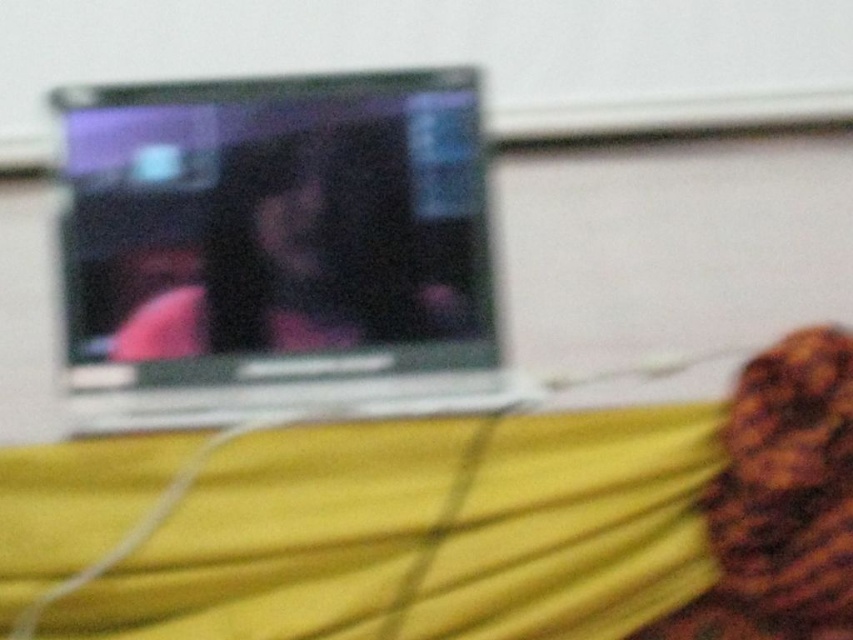
Question: Is yellow fabric at lower center behind silver metallic laptop at upper center?

Choices:
 (A) yes
 (B) no

Answer: (B)

Question: Which of the following is the closest to the observer?

Choices:
 (A) (343, 458)
 (B) (424, 244)

Answer: (A)

Question: Which of the following is the farthest from the observer?

Choices:
 (A) yellow fabric at lower center
 (B) silver metallic laptop at upper center

Answer: (B)

Question: Does yellow fabric at lower center appear over silver metallic laptop at upper center?

Choices:
 (A) yes
 (B) no

Answer: (B)

Question: From the image, what is the correct spatial relationship of yellow fabric at lower center in relation to silver metallic laptop at upper center?

Choices:
 (A) above
 (B) below

Answer: (B)